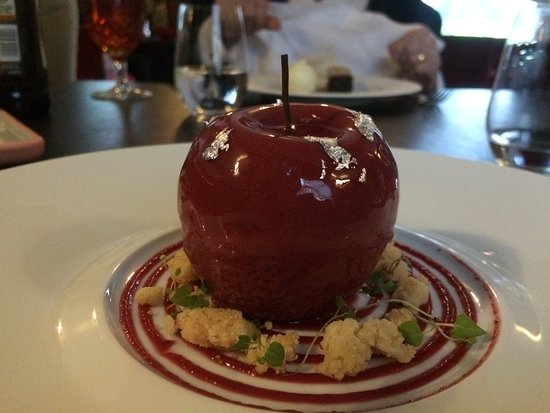
Locate an element on the screen. The width and height of the screenshot is (550, 413). light shining on plate is located at coordinates (89, 320).